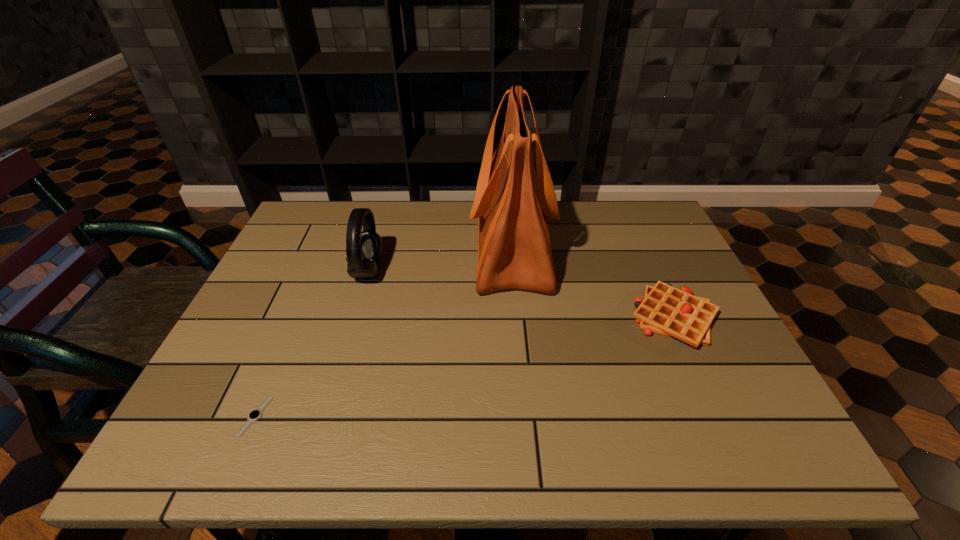
Find the location of `the third object from left to right`. the third object from left to right is located at coordinates (511, 204).

The height and width of the screenshot is (540, 960). In order to click on shopping bag in this screenshot , I will do `click(511, 204)`.

The width and height of the screenshot is (960, 540). Find the location of `the third shortest object`. the third shortest object is located at coordinates (364, 249).

At what (x,y) coordinates should I click in order to perform the action: click on the third object from right to left. Please return your answer as a coordinate pair (x, y). Image resolution: width=960 pixels, height=540 pixels. Looking at the image, I should click on (364, 249).

You are a GUI agent. You are given a task and a screenshot of the screen. Output one action in this format:
    pyautogui.click(x=<x>, y=<y>)
    Task: Click on the waffle
    
    Given the screenshot: What is the action you would take?
    pyautogui.click(x=666, y=310)

In order to click on the third tallest object in this screenshot , I will do `click(666, 310)`.

Where is `watch`? This screenshot has width=960, height=540. watch is located at coordinates (255, 414).

This screenshot has width=960, height=540. I want to click on the nearest object, so click(255, 414).

Identify the location of vacant region located on the front pocket of the shopping bag. (453, 248).

The width and height of the screenshot is (960, 540). I want to click on vacant area situated on the front pocket of the shopping bag, so click(367, 248).